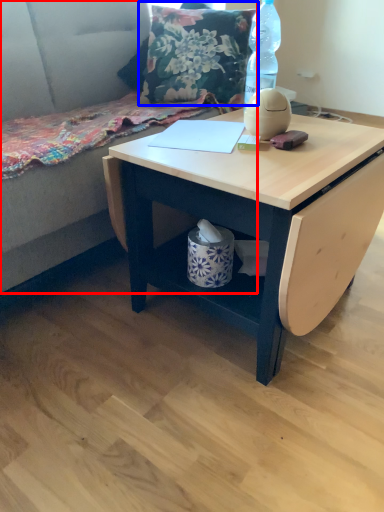
Question: Which point is further to the camera, couch (highlighted by a red box) or throw pillow (highlighted by a blue box)?

Choices:
 (A) couch
 (B) throw pillow

Answer: (B)